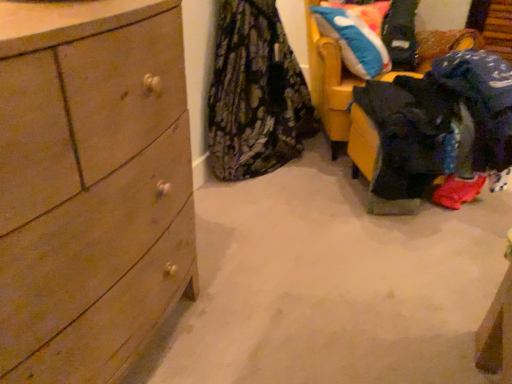
Question: Considering the relative positions of blue plush pillow at upper right and yellow fabric chair at upper right in the image provided, is blue plush pillow at upper right to the right of yellow fabric chair at upper right from the viewer's perspective?

Choices:
 (A) no
 (B) yes

Answer: (B)

Question: Does blue plush pillow at upper right have a smaller size compared to yellow fabric chair at upper right?

Choices:
 (A) yes
 (B) no

Answer: (A)

Question: Is yellow fabric chair at upper right a part of blue plush pillow at upper right?

Choices:
 (A) yes
 (B) no

Answer: (B)

Question: Is blue plush pillow at upper right not close to yellow fabric chair at upper right?

Choices:
 (A) no
 (B) yes

Answer: (A)

Question: From the image's perspective, would you say blue plush pillow at upper right is shown under yellow fabric chair at upper right?

Choices:
 (A) no
 (B) yes

Answer: (A)

Question: From the image's perspective, relative to yellow fabric chair at upper right, is floral fabric skirt at center, the 1th clothing in the left-to-right sequence, above or below?

Choices:
 (A) below
 (B) above

Answer: (A)

Question: Is floral fabric skirt at center, positioned as the 2th clothing in right-to-left order, taller or shorter than yellow fabric chair at upper right?

Choices:
 (A) short
 (B) tall

Answer: (A)

Question: Is floral fabric skirt at center, the 1th clothing in the left-to-right sequence, in front of or behind yellow fabric chair at upper right in the image?

Choices:
 (A) front
 (B) behind

Answer: (A)

Question: Based on their sizes in the image, would you say floral fabric skirt at center, positioned as the 2th clothing in right-to-left order, is bigger or smaller than yellow fabric chair at upper right?

Choices:
 (A) small
 (B) big

Answer: (A)

Question: Relative to yellow fabric chair at upper right, is blue plush pillow at upper right in front or behind?

Choices:
 (A) front
 (B) behind

Answer: (B)

Question: Looking at their shapes, would you say blue plush pillow at upper right is wider or thinner than yellow fabric chair at upper right?

Choices:
 (A) wide
 (B) thin

Answer: (B)

Question: In the image, is blue plush pillow at upper right on the left side or the right side of yellow fabric chair at upper right?

Choices:
 (A) right
 (B) left

Answer: (A)

Question: From the image's perspective, is blue plush pillow at upper right above or below yellow fabric chair at upper right?

Choices:
 (A) above
 (B) below

Answer: (A)

Question: Based on their positions, is dark blue fabric at lower right, which is the second clothing from left to right, located to the left or right of floral fabric skirt at center, the 1th clothing in the left-to-right sequence?

Choices:
 (A) left
 (B) right

Answer: (B)

Question: In terms of height, does dark blue fabric at lower right, the first clothing in the right-to-left sequence, look taller or shorter compared to floral fabric skirt at center, the 1th clothing in the left-to-right sequence?

Choices:
 (A) tall
 (B) short

Answer: (B)